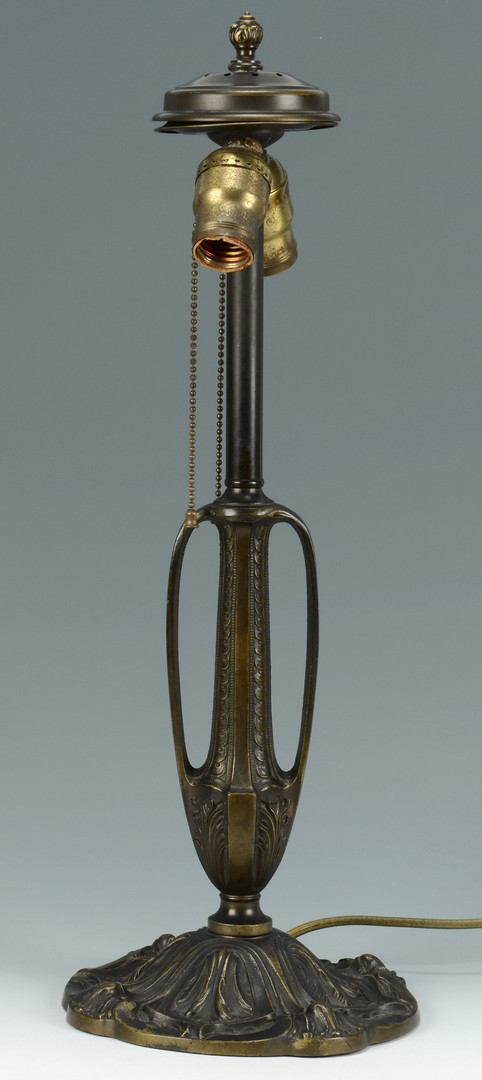
You are a GUI agent. You are given a task and a screenshot of the screen. Output one action in this format:
    pyautogui.click(x=<x>, y=<y>)
    Task: Click on the tablsocket
    The height and width of the screenshot is (1080, 482).
    Given the screenshot: What is the action you would take?
    pyautogui.click(x=49, y=1056), pyautogui.click(x=212, y=257)